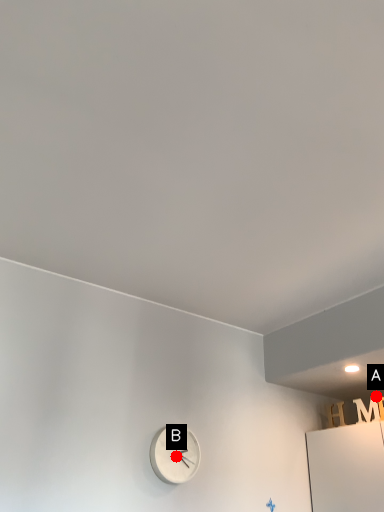
Question: Two points are circled on the image, labeled by A and B beside each circle. Which point is closer to the camera?

Choices:
 (A) A is closer
 (B) B is closer

Answer: (B)